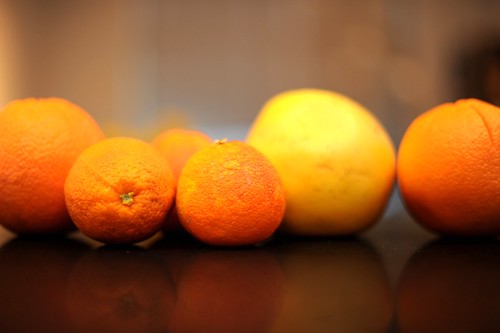
The width and height of the screenshot is (500, 333). What are the coordinates of `shadow of orange on table` in the screenshot? It's located at (454, 270), (43, 270).